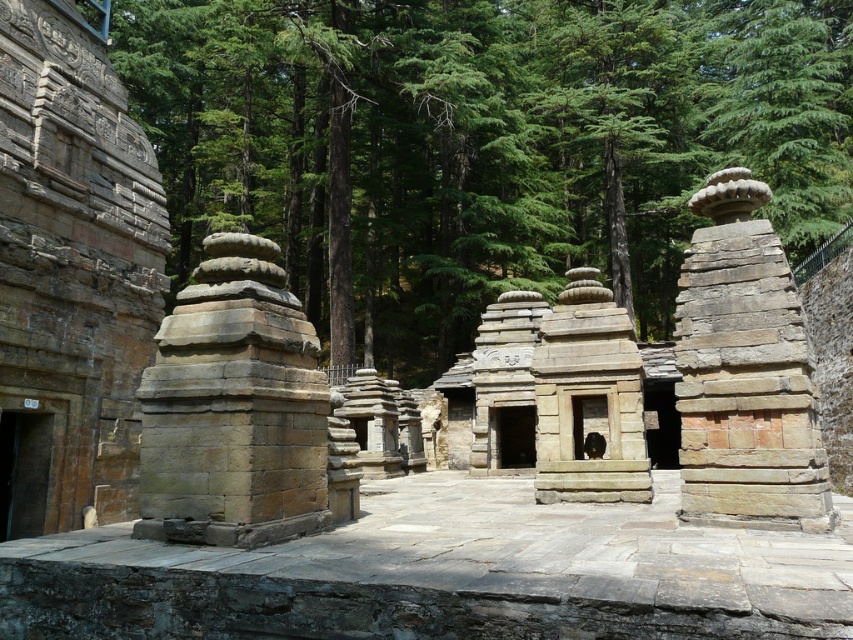
Between point (154, 51) and point (689, 371), which one is positioned in front?

Point (689, 371)

Is green stone trees at center further to the viewer compared to brown stone stupa at center-right?

Yes, it is.

The width and height of the screenshot is (853, 640). I want to click on green stone trees at center, so click(x=482, y=145).

Locate an element on the screen. green stone trees at center is located at coordinates (482, 145).

Is brown stone stupa at center-right to the left of natural stone temple at center from the viewer's perspective?

No, brown stone stupa at center-right is not to the left of natural stone temple at center.

Does brown stone stupa at center-right have a greater height compared to natural stone temple at center?

Incorrect, brown stone stupa at center-right's height is not larger of natural stone temple at center's.

This screenshot has width=853, height=640. What are the coordinates of `brown stone stupa at center-right` in the screenshot? It's located at (746, 372).

Identify the location of brown stone stupa at center-right. (746, 372).

Between green stone trees at center and natural stone temple at center, which one has more height?

green stone trees at center is taller.

Locate an element on the screen. The width and height of the screenshot is (853, 640). green stone trees at center is located at coordinates (482, 145).